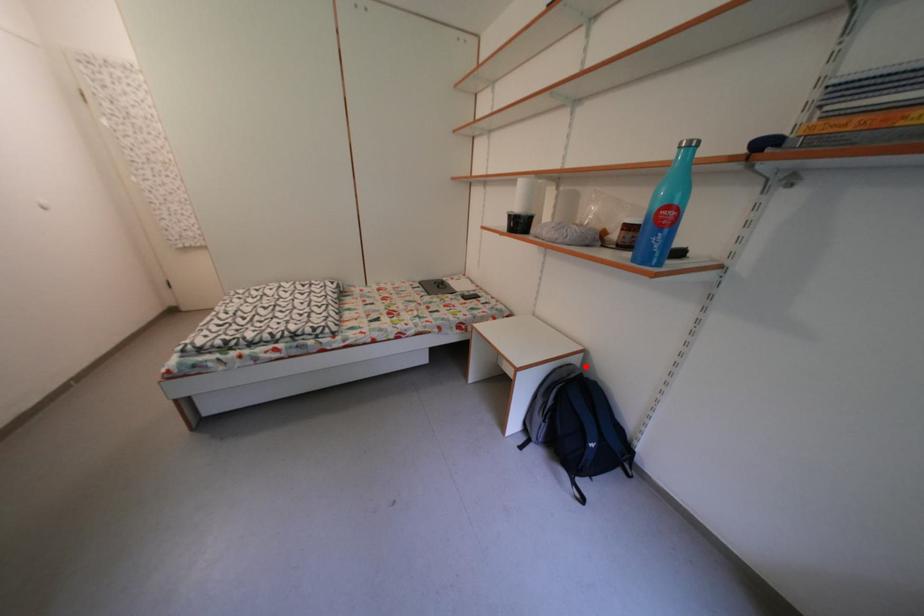
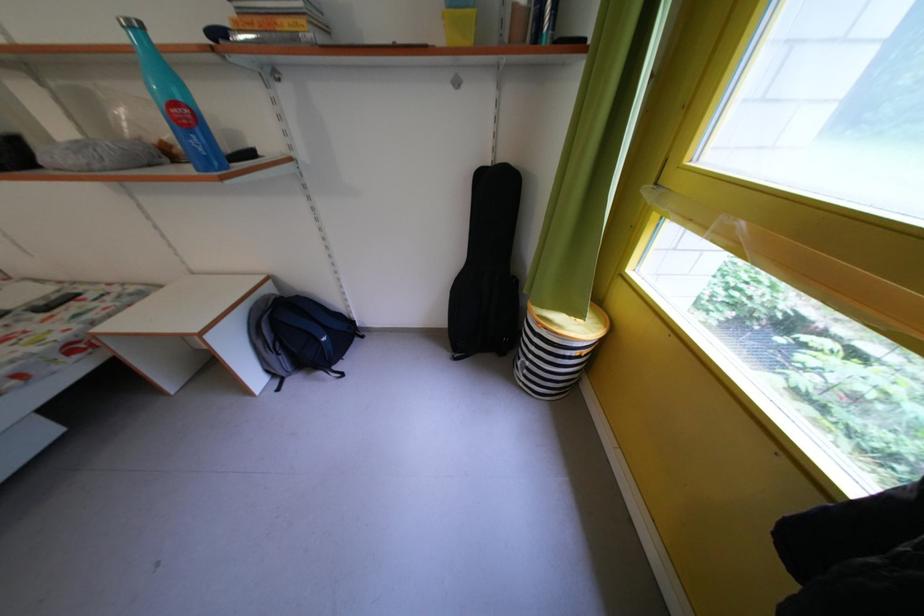
The point at the highlighted location is marked in the first image. Where is the corresponding point in the second image?

(278, 296)